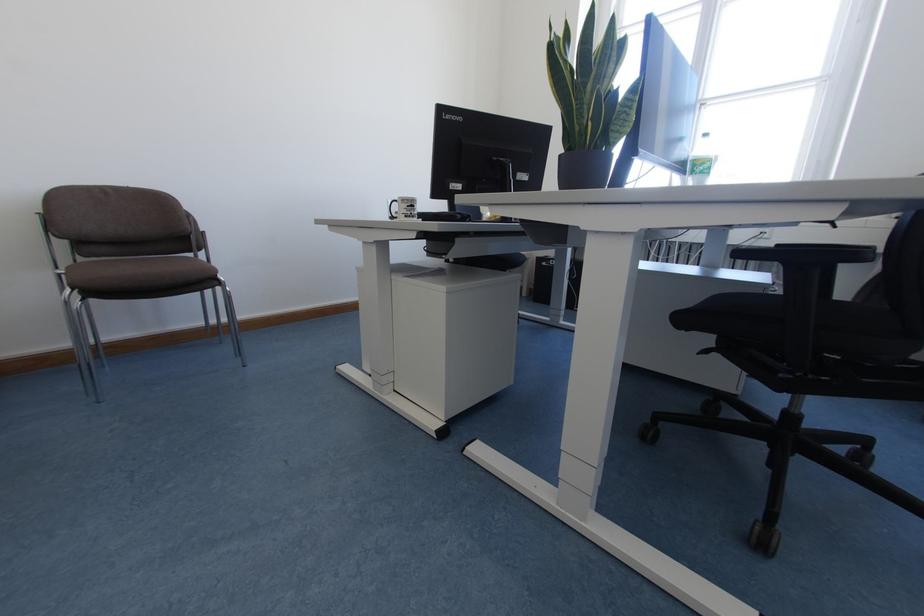
Describe the element at coordinates (402, 208) in the screenshot. I see `the mug handle` at that location.